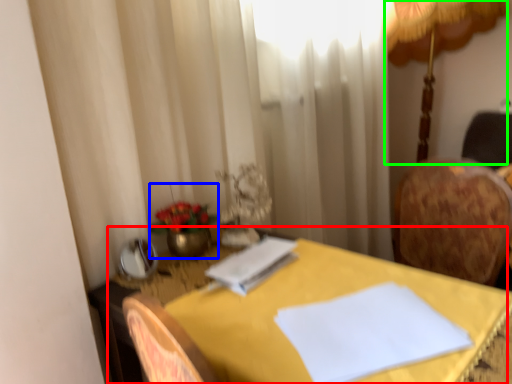
Question: Based on their relative distances, which object is farther from table (highlighted by a red box)? Choose from floral arrangement (highlighted by a blue box) and table lamp (highlighted by a green box).

Choices:
 (A) floral arrangement
 (B) table lamp

Answer: (B)